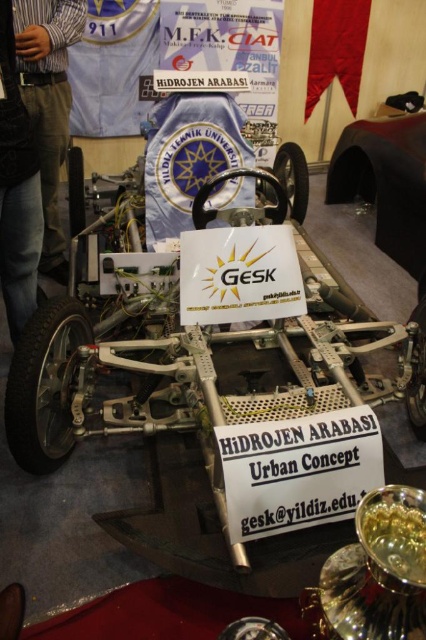
What is the spatial relationship between the glossy black car at center and the brown denim pants at left?

The brown denim pants at left is behind the glossy black car at center.